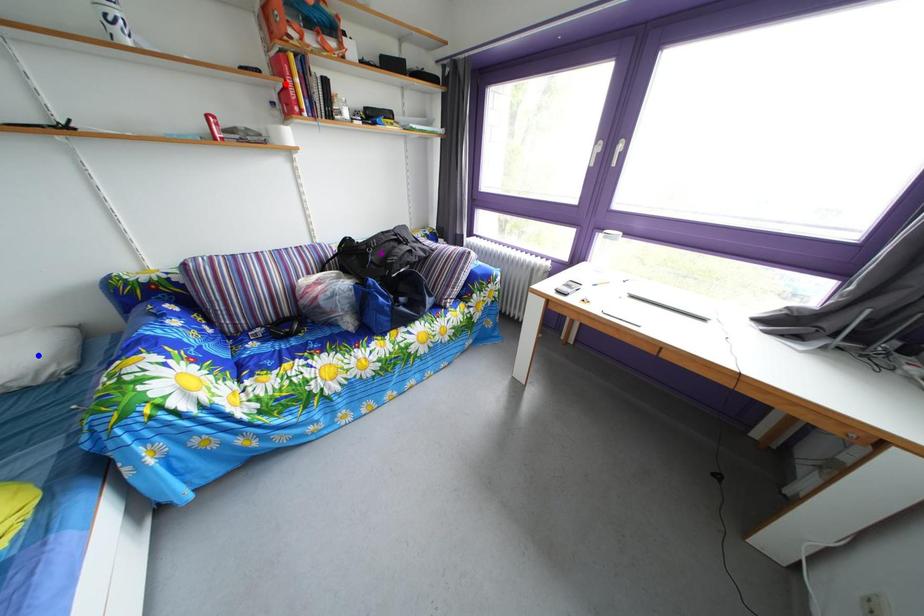
Order these from nearest to farthest:
purple point, blue point, red point

blue point, red point, purple point